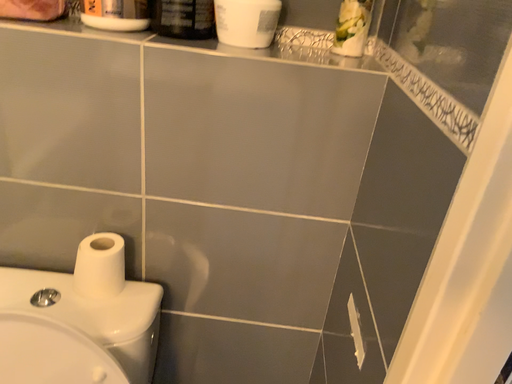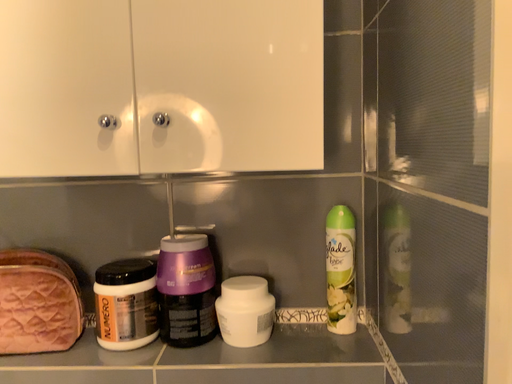
Question: How did the camera likely rotate when shooting the video?

Choices:
 (A) rotated downward
 (B) rotated upward

Answer: (B)